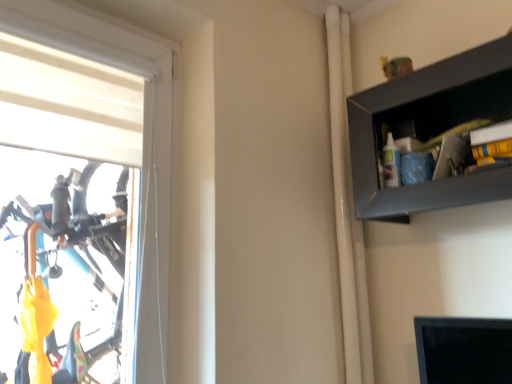
Find the location of `matte black shelf at upper right`. matte black shelf at upper right is located at coordinates (430, 129).

This screenshot has width=512, height=384. What do you see at coordinates (430, 129) in the screenshot?
I see `matte black shelf at upper right` at bounding box center [430, 129].

At what (x,y) coordinates should I click in order to perform the action: click on matte black shelf at upper right. Please return your answer as a coordinate pair (x, y). Looking at the image, I should click on (430, 129).